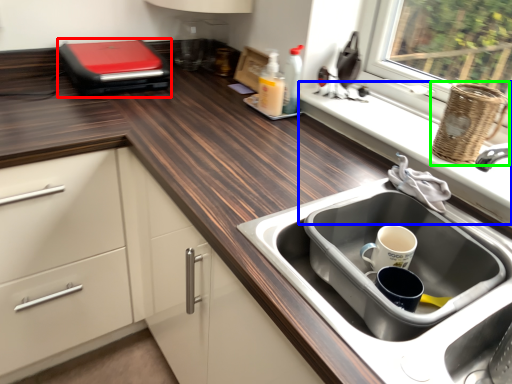
Question: Which is farther away from appliance (highlighted by a red box)? window sill (highlighted by a blue box) or basket (highlighted by a green box)?

Choices:
 (A) window sill
 (B) basket

Answer: (B)